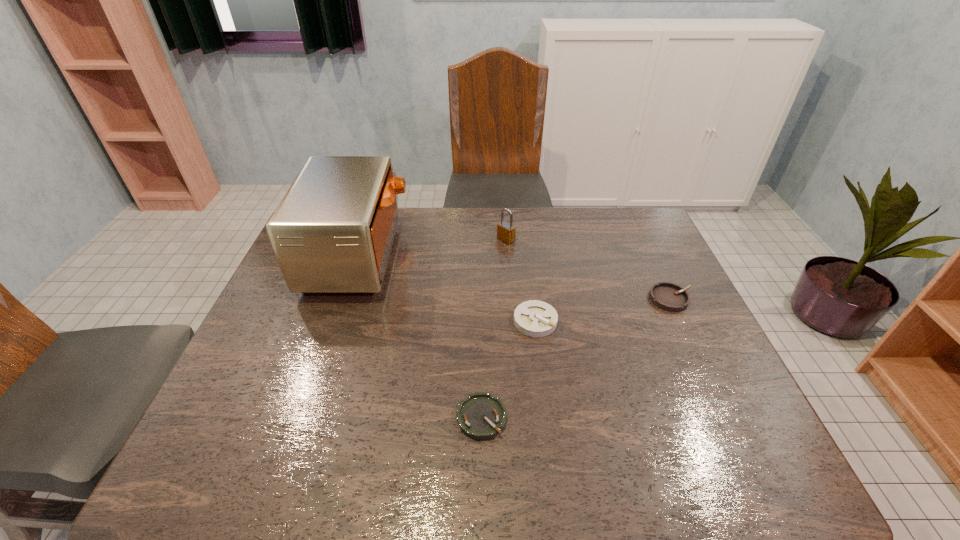
The height and width of the screenshot is (540, 960). I want to click on free location located on the left of the rightmost ashtray, so click(573, 299).

This screenshot has height=540, width=960. I want to click on vacant region located 0.100m on the left of the shortest ashtray, so click(x=409, y=417).

The width and height of the screenshot is (960, 540). I want to click on toaster oven that is at the far edge, so click(x=332, y=233).

Identify the location of padlock located in the far edge section of the desktop. This screenshot has width=960, height=540. (506, 231).

Locate an element on the screen. The image size is (960, 540). object that is at the near edge is located at coordinates (481, 416).

Locate an element on the screen. This screenshot has width=960, height=540. object that is positioned at the left edge is located at coordinates (332, 233).

The width and height of the screenshot is (960, 540). Identify the location of object at the right edge. (667, 296).

Find the location of a particular element. object present at the far left corner is located at coordinates (332, 233).

In the image, there is a desktop. Where is `free space at the far edge`? free space at the far edge is located at coordinates (410, 235).

Where is `free space at the near edge of the desktop`? This screenshot has width=960, height=540. free space at the near edge of the desktop is located at coordinates (660, 463).